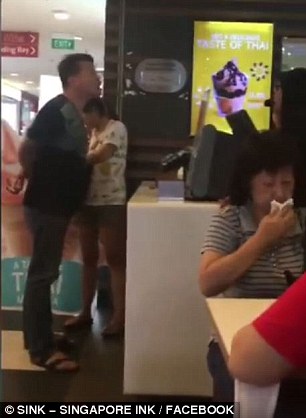
Image resolution: width=306 pixels, height=418 pixels. Find the location of `rug`. rug is located at coordinates (14, 359).